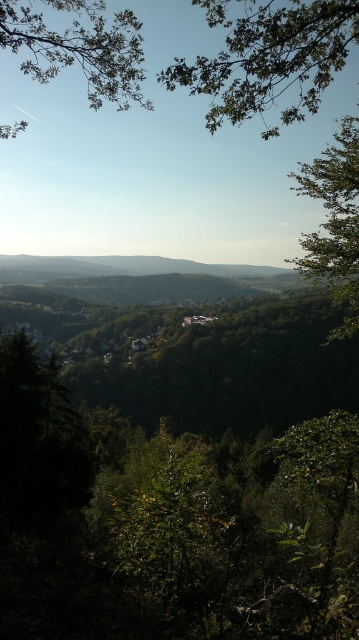
Question: Does green leafy branch at upper center appear on the right side of green leafy hillside at center?

Choices:
 (A) no
 (B) yes

Answer: (B)

Question: Which object is farther from the camera taking this photo?

Choices:
 (A) green leafy tree at upper left
 (B) green leafy branch at upper center
 (C) green leafy tree at right
 (D) green leafy hillside at center

Answer: (D)

Question: Is green leafy branch at upper center bigger than green leafy tree at upper left?

Choices:
 (A) no
 (B) yes

Answer: (A)

Question: Does green leafy tree at upper left have a smaller size compared to green leafy tree at right?

Choices:
 (A) no
 (B) yes

Answer: (A)

Question: Which point appears closest to the camera in this image?

Choices:
 (A) (95, 67)
 (B) (250, 35)
 (C) (145, 266)
 (D) (352, 320)

Answer: (B)

Question: Which object appears closest to the camera in this image?

Choices:
 (A) green leafy tree at upper left
 (B) green leafy branch at upper center
 (C) green leafy tree at right

Answer: (B)